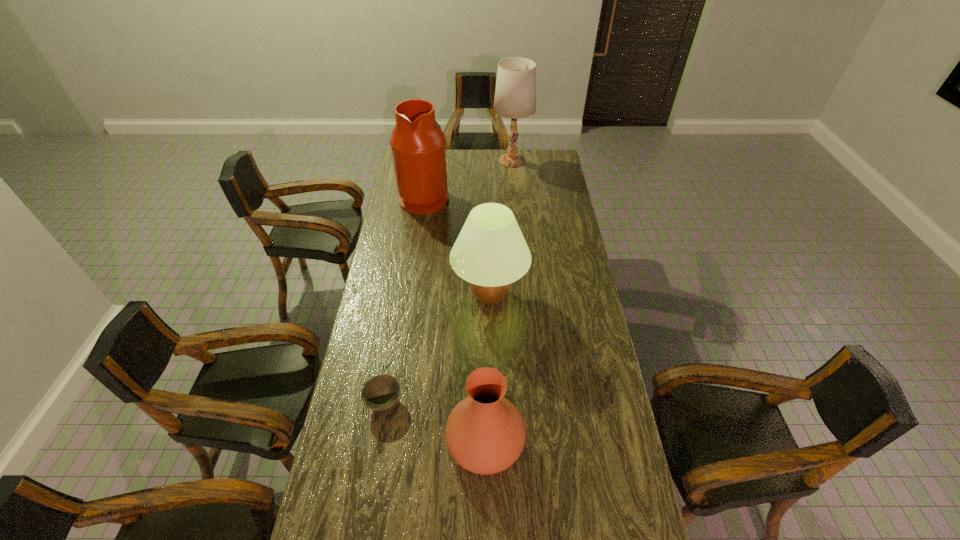
Locate an element on the screen. Image resolution: width=960 pixels, height=540 pixels. vacant space located on the front of the shortest object is located at coordinates (372, 480).

Locate an element on the screen. object that is positioned at the far edge is located at coordinates (515, 95).

Locate an element on the screen. The height and width of the screenshot is (540, 960). water jug positioned at the left edge is located at coordinates (417, 142).

The height and width of the screenshot is (540, 960). What are the coordinates of `bowl positioned at the left edge` in the screenshot? It's located at (381, 392).

In order to click on object that is at the right edge in this screenshot , I will do `click(515, 95)`.

Find the location of a particular element. The image size is (960, 540). object present at the far right corner is located at coordinates (515, 95).

This screenshot has height=540, width=960. I want to click on free region at the far edge, so click(473, 163).

The width and height of the screenshot is (960, 540). In order to click on free space at the left edge of the desktop in this screenshot , I will do `click(344, 456)`.

In order to click on vacant point at the right edge in this screenshot , I will do `click(572, 416)`.

In the image, there is a desktop. Identify the location of free space at the far right corner. The image size is (960, 540). (532, 169).